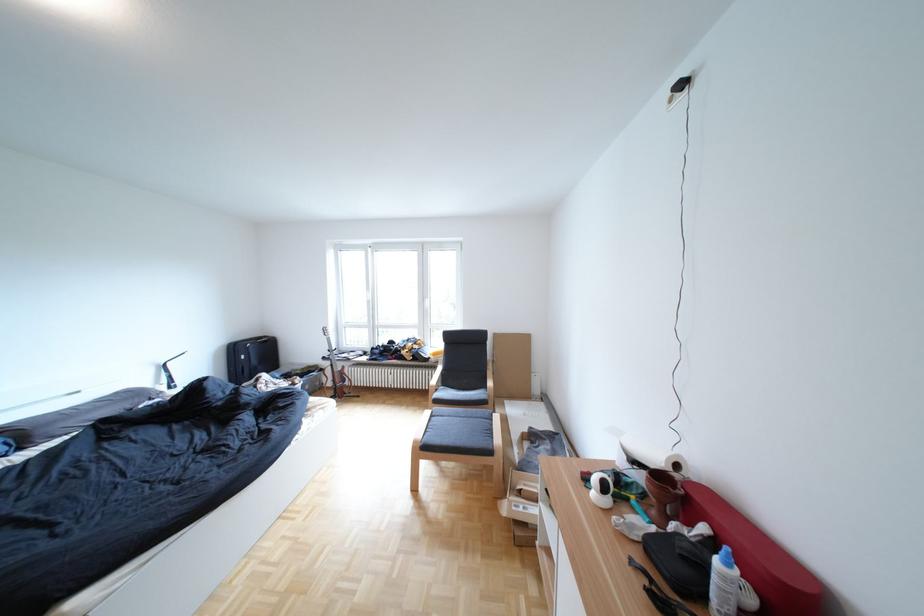
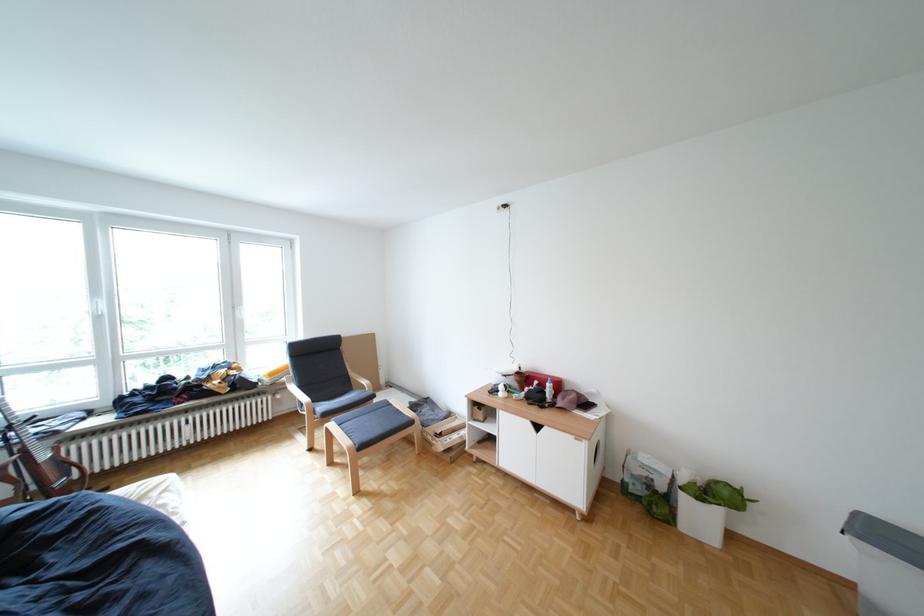
Locate, in the second image, the point that corresponds to pixel 536 493 in the first image.

(456, 436)